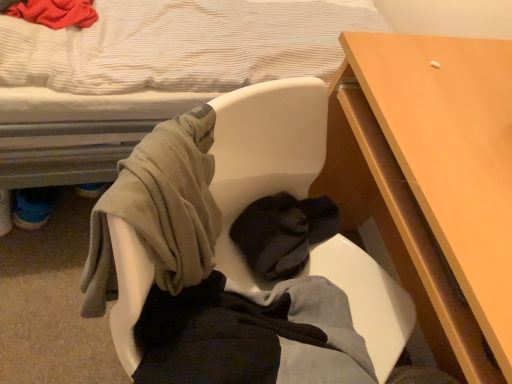
Question: Is white fabric bed at upper left spatially inside wooden desk at center right, or outside of it?

Choices:
 (A) outside
 (B) inside

Answer: (A)

Question: In terms of height, does white fabric bed at upper left look taller or shorter compared to wooden desk at center right?

Choices:
 (A) tall
 (B) short

Answer: (A)

Question: Estimate the real-world distances between objects in this image. Which object is closer to the soft fabric chair at center?

Choices:
 (A) wooden desk at center right
 (B) white fabric bed at upper left

Answer: (A)

Question: Estimate the real-world distances between objects in this image. Which object is farther from the soft fabric chair at center?

Choices:
 (A) white fabric bed at upper left
 (B) wooden desk at center right

Answer: (A)